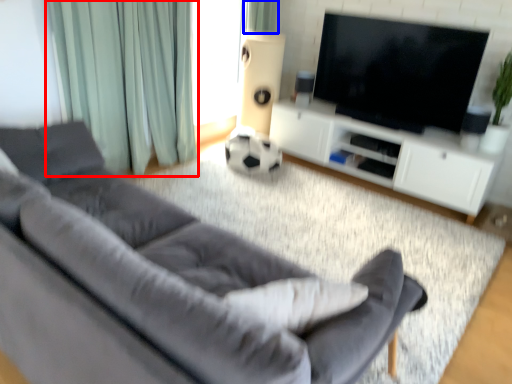
Question: Which point is closer to the camera, curtain (highlighted by a red box) or curtain (highlighted by a blue box)?

Choices:
 (A) curtain
 (B) curtain

Answer: (A)